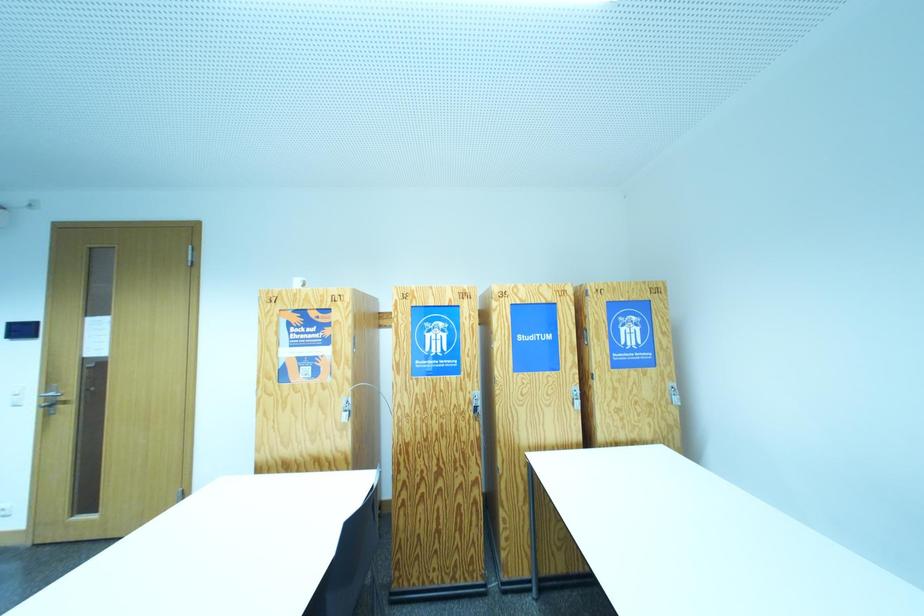
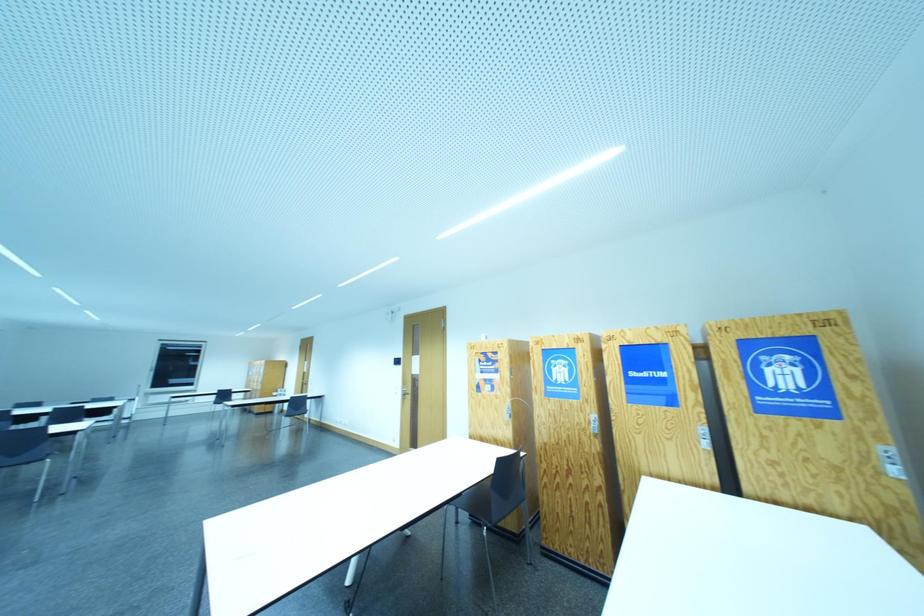
Question: How did the camera likely rotate?

Choices:
 (A) Left
 (B) Right
 (C) Up
 (D) Down

Answer: (A)